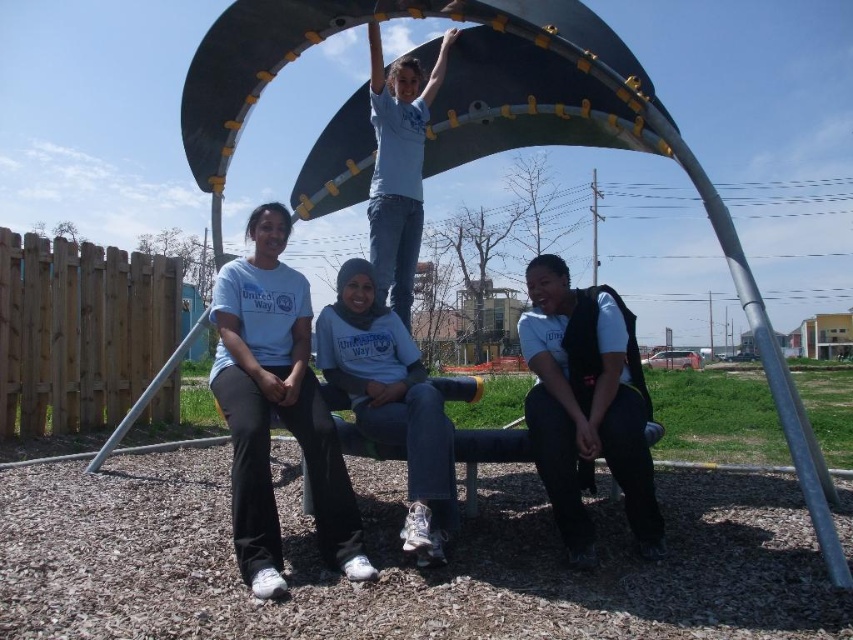
You are a photographer trying to capture a photo of the black matte vest at lower right and the gray matte hoodie at center. The camera you are using has a maximum focus range of 35 inches. Will you be able to focus on both subjects simultaneously?

The black matte vest at lower right and gray matte hoodie at center are 35.71 inches apart. Since the distance between them exceeds the camera maximum focus range of 35 inches, you cannot focus on both subjects simultaneously.

You are a photographer trying to capture the black matte vest at lower right in your shot. Based on the scene description, where should you position your camera to ensure the vest is centered in the frame?

To center the black matte vest at lower right in your frame, position your camera so that it aligns with the coordinates provided at point (x=585, y=404), ensuring the vest is precisely in the center of the image.

You are trying to take a photo of the gray matte hoodie at center but the black matte vest at lower right is blocking your view. Can you move around to the left side to get a clear shot?

The gray matte hoodie at center is behind the black matte vest at lower right, so moving to the left side might allow you to see around the black matte vest at lower right and capture the gray matte hoodie at center in your photo.